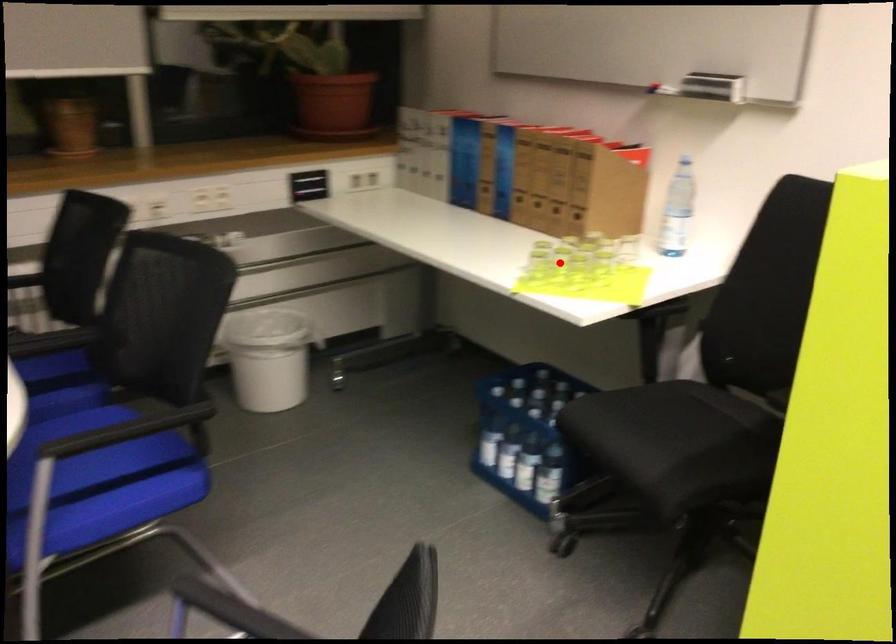
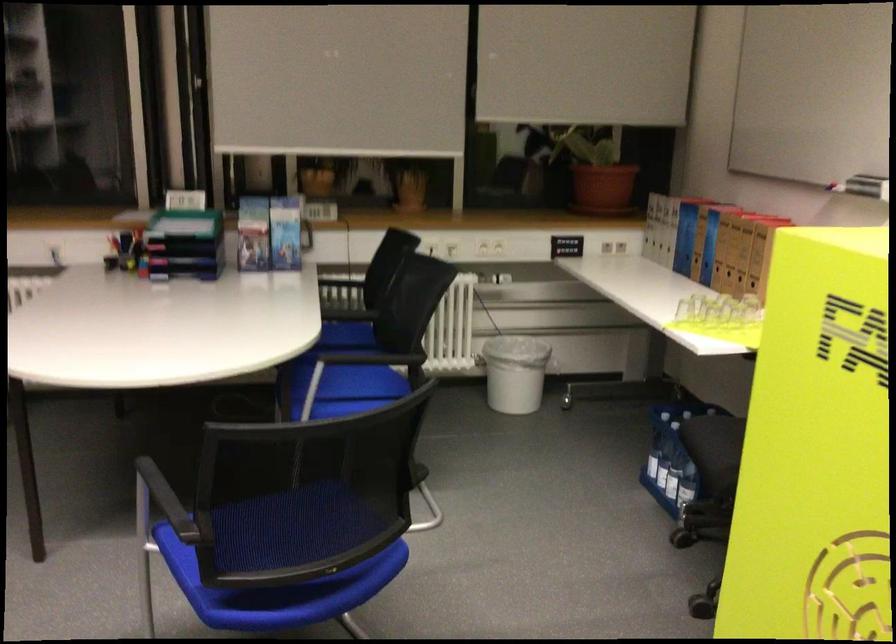
Question: I am providing you with two images of the same scene from different viewpoints. A red point is marked on the first image. Is the red point's position out of view in image 2?

Choices:
 (A) Yes
 (B) No

Answer: (B)